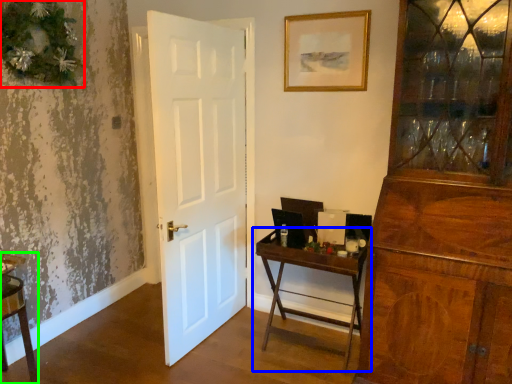
Question: Considering the real-world distances, which object is farthest from christmas decoration (highlighted by a red box)? table (highlighted by a blue box) or vanity (highlighted by a green box)?

Choices:
 (A) table
 (B) vanity

Answer: (A)